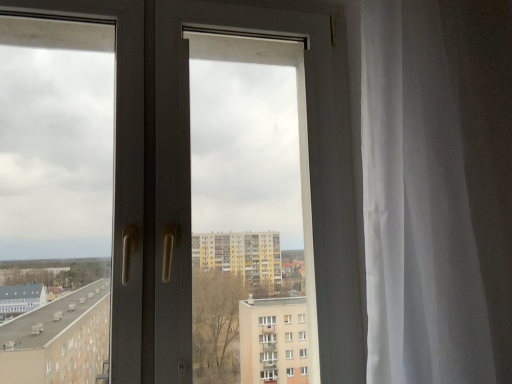
From the picture: What is the approximate width of white glossy door at center?

white glossy door at center is 10.49 centimeters wide.

Locate an element on the screen. This screenshot has width=512, height=384. white glossy door at center is located at coordinates (181, 173).

What do you see at coordinates (181, 173) in the screenshot? The width and height of the screenshot is (512, 384). I see `white glossy door at center` at bounding box center [181, 173].

Where is `white sheer curtain at right`? Image resolution: width=512 pixels, height=384 pixels. white sheer curtain at right is located at coordinates (437, 189).

Image resolution: width=512 pixels, height=384 pixels. What do you see at coordinates (437, 189) in the screenshot?
I see `white sheer curtain at right` at bounding box center [437, 189].

Identify the location of white glossy door at center. This screenshot has height=384, width=512. (181, 173).

Between white glossy door at center and white sheer curtain at right, which one appears on the left side from the viewer's perspective?

white glossy door at center.

Is white glossy door at center positioned behind white sheer curtain at right?

Yes, white glossy door at center is behind white sheer curtain at right.

Between point (144, 77) and point (509, 123), which one is positioned in front?

The point (509, 123) is closer to the camera.

From the image's perspective, is white glossy door at center over white sheer curtain at right?

No.

Based on the photo, from a real-world perspective, is white glossy door at center on top of white sheer curtain at right?

Correct, in the physical world, white glossy door at center is higher than white sheer curtain at right.

Looking at their sizes, would you say white glossy door at center is wider or thinner than white sheer curtain at right?

In the image, white glossy door at center appears to be more narrow than white sheer curtain at right.

Is white glossy door at center taller than white sheer curtain at right?

Indeed, white glossy door at center has a greater height compared to white sheer curtain at right.

Considering the sizes of objects white glossy door at center and white sheer curtain at right in the image provided, who is smaller, white glossy door at center or white sheer curtain at right?

With smaller size is white glossy door at center.

Is white glossy door at center situated inside white sheer curtain at right or outside?

white glossy door at center is located beyond the bounds of white sheer curtain at right.

Is white glossy door at center next to white sheer curtain at right and touching it?

They are not placed beside each other.

Is white glossy door at center facing towards white sheer curtain at right?

No, white glossy door at center is not facing towards white sheer curtain at right.

How many degrees apart are the facing directions of white glossy door at center and white sheer curtain at right?

There is a 0.876-degree angle between the facing directions of white glossy door at center and white sheer curtain at right.

Locate an element on the screen. door on the left of white sheer curtain at right is located at coordinates (181, 173).

Between white sheer curtain at right and white glossy door at center, which one appears on the right side from the viewer's perspective?

From the viewer's perspective, white sheer curtain at right appears more on the right side.

Consider the image. Which object is closer to the camera taking this photo, white sheer curtain at right or white glossy door at center?

white sheer curtain at right is more forward.

Considering the points (471, 91) and (318, 299), which point is in front, point (471, 91) or point (318, 299)?

The point (471, 91) is closer to the camera.

From the image's perspective, relative to white glossy door at center, is white sheer curtain at right above or below?

white sheer curtain at right is situated higher than white glossy door at center in the image.

From a real-world perspective, is white sheer curtain at right positioned over white glossy door at center based on gravity?

Actually, white sheer curtain at right is physically below white glossy door at center in the real world.

Which object is wider, white sheer curtain at right or white glossy door at center?

With larger width is white sheer curtain at right.

Considering the sizes of objects white sheer curtain at right and white glossy door at center in the image provided, who is taller, white sheer curtain at right or white glossy door at center?

Standing taller between the two is white glossy door at center.

Does white sheer curtain at right have a larger size compared to white glossy door at center?

Correct, white sheer curtain at right is larger in size than white glossy door at center.

Choose the correct answer: Is white sheer curtain at right inside white glossy door at center or outside it?

white sheer curtain at right is located beyond the bounds of white glossy door at center.

Are white sheer curtain at right and white glossy door at center making contact?

white sheer curtain at right is not next to white glossy door at center, and they're not touching.

Is white sheer curtain at right positioned with its back to white glossy door at center?

No, white sheer curtain at right is not facing away from white glossy door at center.

How many degrees apart are the facing directions of white sheer curtain at right and white glossy door at center?

0.876 degrees separate the facing orientations of white sheer curtain at right and white glossy door at center.

Measure the distance from white sheer curtain at right to white glossy door at center.

The distance of white sheer curtain at right from white glossy door at center is 15.05 inches.

Locate an element on the screen. door below the white sheer curtain at right (from the image's perspective) is located at coordinates (181, 173).

At what (x,y) coordinates should I click in order to perform the action: click on curtain below the white glossy door at center (from a real-world perspective). Please return your answer as a coordinate pair (x, y). The width and height of the screenshot is (512, 384). Looking at the image, I should click on (437, 189).

In the image, there is a white sheer curtain at right. Where is `door below it (from the image's perspective)`? door below it (from the image's perspective) is located at coordinates (181, 173).